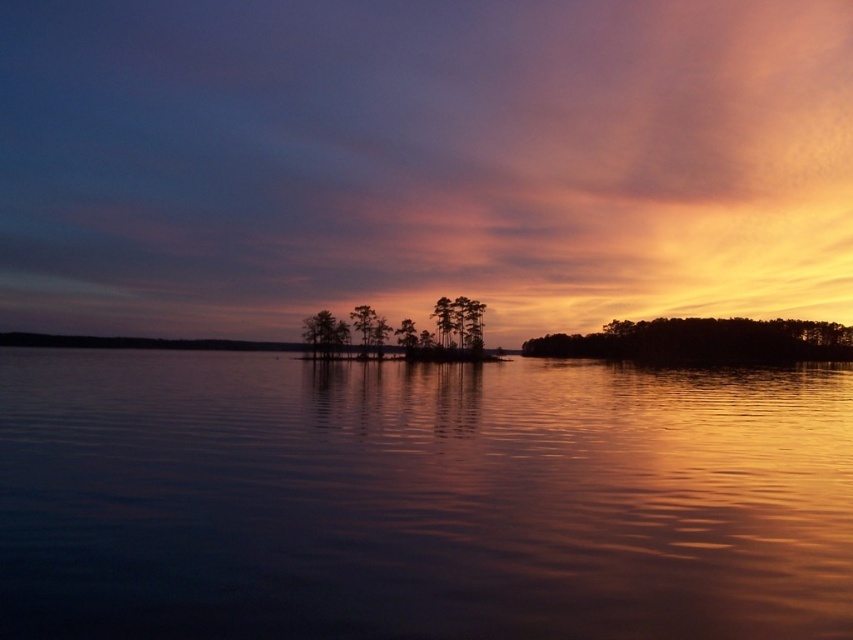
Question: Which is farther from the silhouette tree at center?

Choices:
 (A) smooth water at center
 (B) silhouette pine tree at center

Answer: (A)

Question: Does orange/yellow cloud at upper center appear under silhouette pine tree at center?

Choices:
 (A) no
 (B) yes

Answer: (A)

Question: Does orange/yellow cloud at upper center have a larger size compared to silky brown tree at center?

Choices:
 (A) yes
 (B) no

Answer: (A)

Question: Does smooth water at center appear on the left side of silhouette tree at center?

Choices:
 (A) no
 (B) yes

Answer: (A)

Question: Which object is closer to the camera taking this photo?

Choices:
 (A) silhouette tree at center
 (B) silky brown tree at center
 (C) smooth water at center
 (D) orange/yellow cloud at upper center

Answer: (C)

Question: Which of the following is the farthest from the observer?

Choices:
 (A) (821, 330)
 (B) (572, 10)
 (C) (367, 324)
 (D) (749, 464)

Answer: (B)